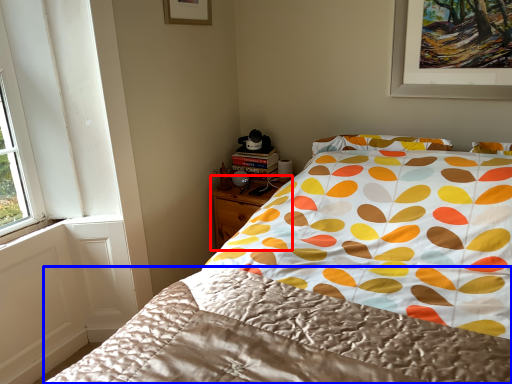
Question: Which point is further to the camera, nightstand (highlighted by a red box) or blanket (highlighted by a blue box)?

Choices:
 (A) nightstand
 (B) blanket

Answer: (A)